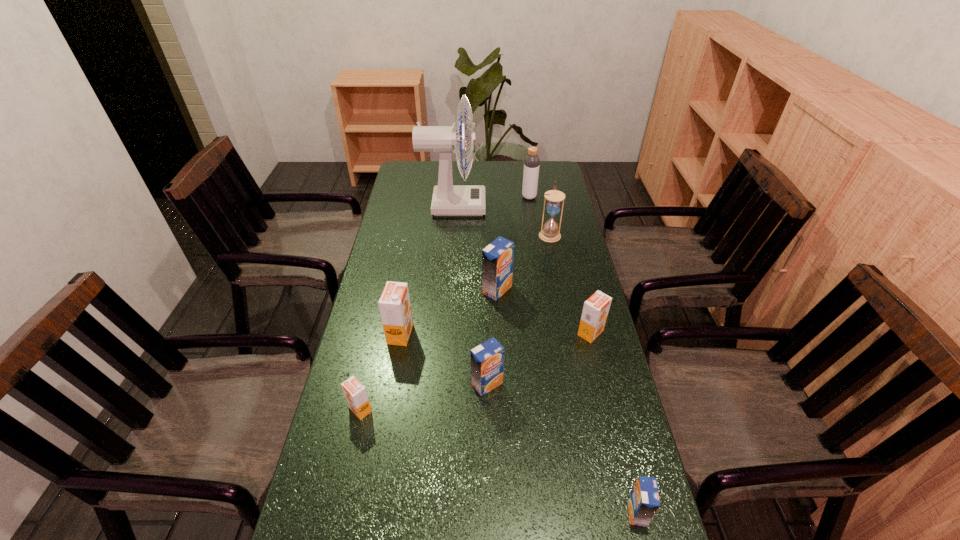
At what (x,y) coordinates should I click in order to perform the action: click on vacant area situated 0.110m on the back of the third nearest object. Please return your answer as a coordinate pair (x, y). This screenshot has width=960, height=540. Looking at the image, I should click on (487, 340).

Identify the location of vacant space situated 0.150m on the back of the rightmost orange orange juice. The image size is (960, 540). (580, 288).

Identify the location of free region located on the back of the smallest blue orange_juice. This screenshot has height=540, width=960. (600, 363).

The width and height of the screenshot is (960, 540). Identify the location of vacant space located 0.160m on the front of the nearest orange orange juice. (343, 486).

Locate an element on the screen. This screenshot has height=540, width=960. object that is at the far edge is located at coordinates (448, 200).

This screenshot has height=540, width=960. I want to click on fan at the left edge, so click(448, 200).

The image size is (960, 540). I want to click on bottle that is at the right edge, so click(532, 161).

At what (x,y) coordinates should I click in order to perform the action: click on hourglass that is at the right edge. Please return your answer as a coordinate pair (x, y). Image resolution: width=960 pixels, height=540 pixels. Looking at the image, I should click on (550, 233).

This screenshot has height=540, width=960. I want to click on object that is at the far left corner, so click(448, 200).

In the image, there is a desktop. Where is `free space at the far edge`? free space at the far edge is located at coordinates pyautogui.click(x=473, y=165).